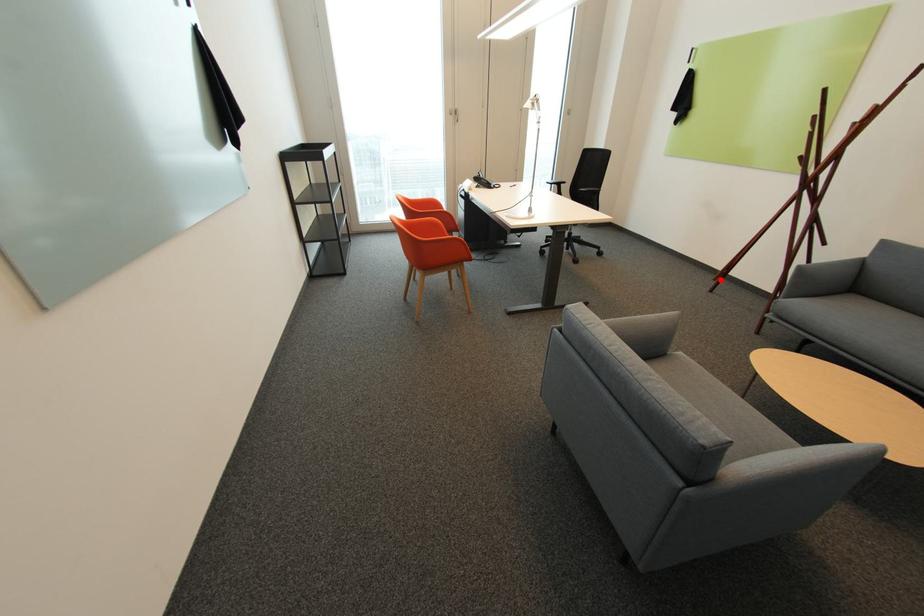
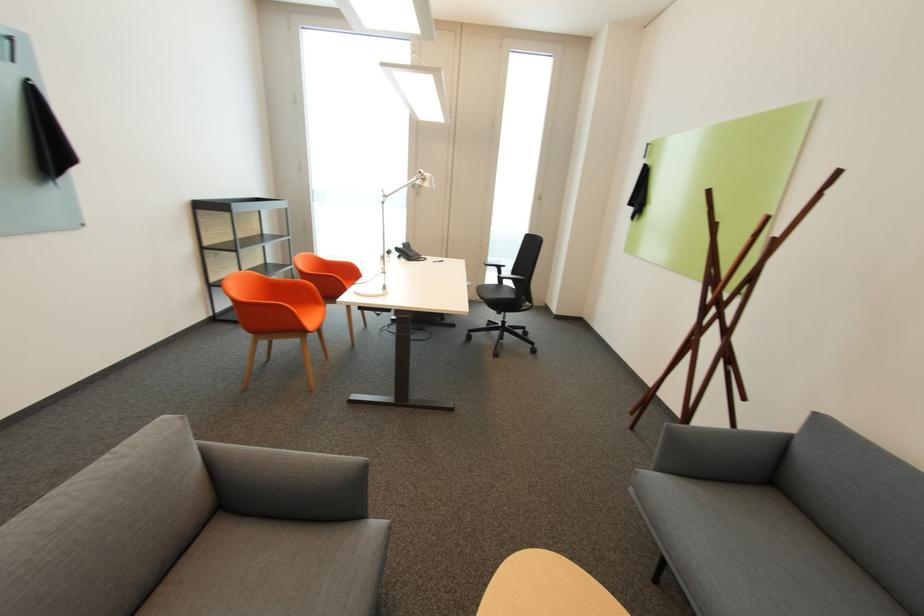
Question: I am providing you with two images of the same scene from different viewpoints. Given a red point in image1, look at the same physical point in image2. Is it:

Choices:
 (A) Closer to the viewpoint
 (B) Farther from the viewpoint

Answer: (A)